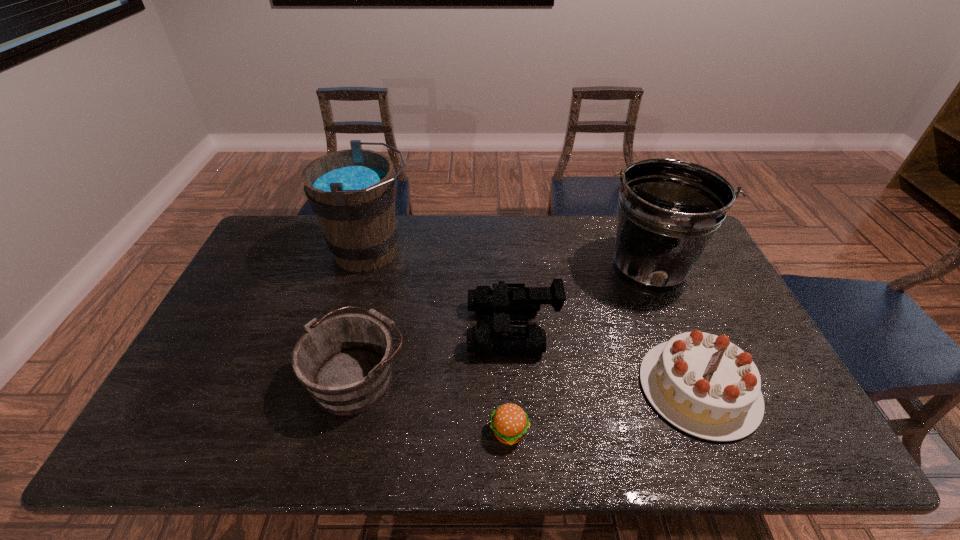
The height and width of the screenshot is (540, 960). I want to click on vacant space that is in between the binoculars and the birthday cake, so click(606, 359).

Locate an element on the screen. The width and height of the screenshot is (960, 540). free space between the hamburger and the shorter wine bucket is located at coordinates (434, 404).

Find the location of a particular element. free area in between the birthday cake and the binoculars is located at coordinates (606, 359).

Where is `unoccupied area between the bucket and the shortest object`? unoccupied area between the bucket and the shortest object is located at coordinates (579, 350).

Image resolution: width=960 pixels, height=540 pixels. What are the coordinates of `free spot between the binoculars and the shorter wine bucket` in the screenshot? It's located at (435, 353).

Locate an element on the screen. The image size is (960, 540). empty location between the birthday cake and the nearer wine bucket is located at coordinates (528, 382).

Identify the location of vacant space in between the birthday cake and the shorter wine bucket. (528, 382).

You are a GUI agent. You are given a task and a screenshot of the screen. Output one action in this format:
    pyautogui.click(x=<x>, y=<y>)
    Task: Click on the empty space that is in between the binoculars and the birthday cake
    This screenshot has height=540, width=960.
    Given the screenshot: What is the action you would take?
    pyautogui.click(x=606, y=359)

Where is `object that ranks as the fifth closest to the farther wine bucket`? This screenshot has height=540, width=960. object that ranks as the fifth closest to the farther wine bucket is located at coordinates (703, 384).

I want to click on object that is the fifth closest one to the bucket, so click(352, 192).